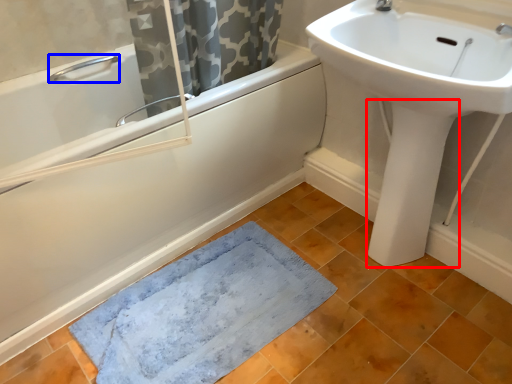
Question: Among these objects, which one is nearest to the camera, bidet (highlighted by a red box) or plumbing fixture (highlighted by a blue box)?

Choices:
 (A) bidet
 (B) plumbing fixture

Answer: (A)